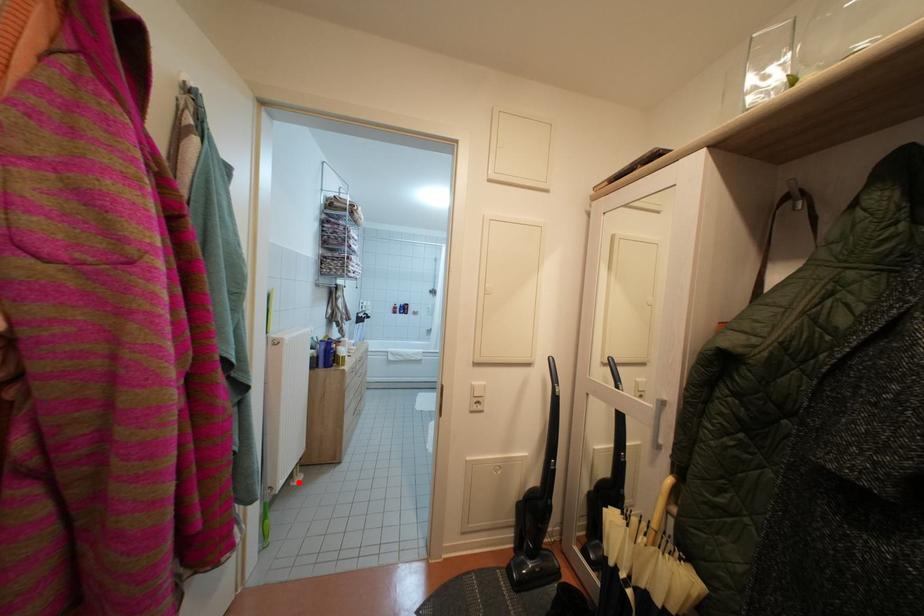
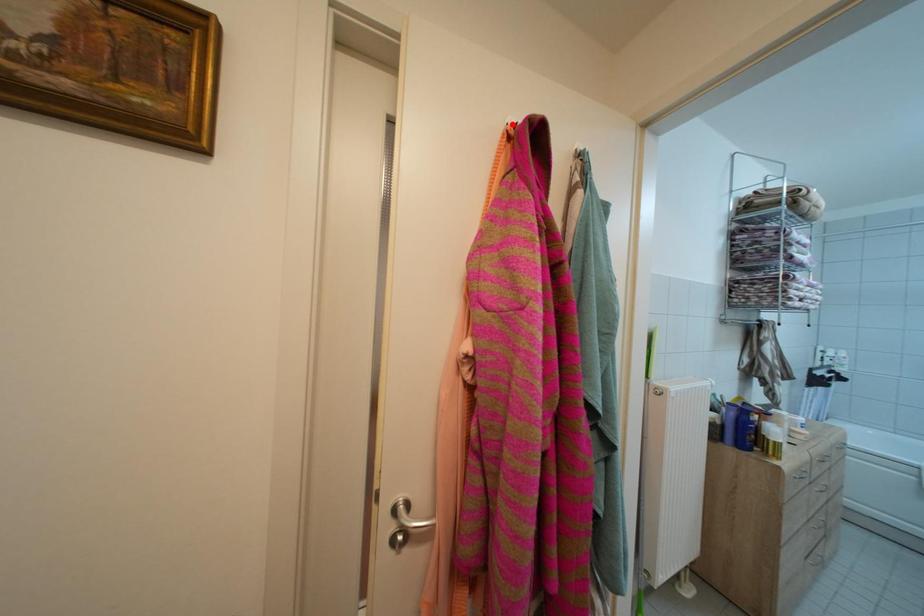
I am providing you with two images of the same scene from different viewpoints. A red point is marked on the first image and another point is marked on the second image. Does the point marked in image1 correspond to the same location as the one in image2?

No